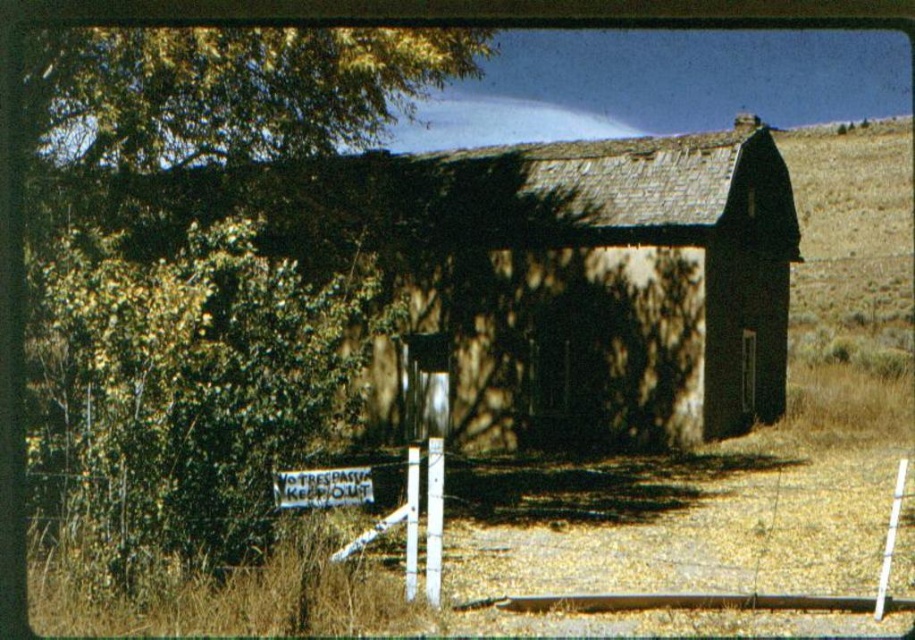
Question: Considering the relative positions of dark brown stone barn at center and white wire fence at lower center in the image provided, where is dark brown stone barn at center located with respect to white wire fence at lower center?

Choices:
 (A) below
 (B) above

Answer: (B)

Question: Is dark brown stone barn at center bigger than white wire fence at lower left?

Choices:
 (A) no
 (B) yes

Answer: (B)

Question: Among these objects, which one is nearest to the camera?

Choices:
 (A) dark brown stone barn at center
 (B) green leafy tree at left

Answer: (B)

Question: Observing the image, what is the correct spatial positioning of green leafy tree at left in reference to dark brown stone barn at center?

Choices:
 (A) left
 (B) right

Answer: (A)

Question: Among these objects, which one is farthest from the camera?

Choices:
 (A) green leafy tree at left
 (B) white wire fence at lower left
 (C) white wire fence at lower center
 (D) dark brown stone barn at center

Answer: (D)

Question: Which of these objects is positioned closest to the white wire fence at lower left?

Choices:
 (A) dark brown stone barn at center
 (B) green leafy tree at left

Answer: (B)